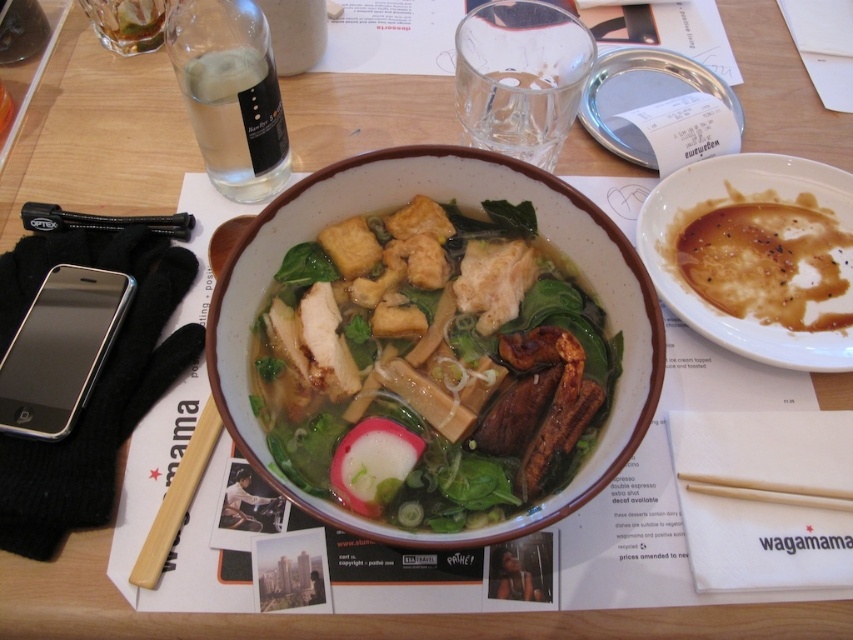
You are a waiter at Wagamama. You need to place a new menu on the table. There are two points marked on the table mat. The first point is at coordinate point(x=601, y=317) and the second is at point(x=165, y=541). According to the spatial arrangement, which point is closer to the edge of the table?

Point(x=165, y=541) is closer to the edge of the table because it is in front of point(x=601, y=317), which is further back.

You are a food delivery person who needs to know if the bowl of translucent broth with mixed vegetables and tofu at center can fit into a container that is the same width as the wooden chopstick at center. Can it fit?

The translucent broth with mixed vegetables and tofu at center is wider than the wooden chopstick at center, so the container with the same width as the chopstick would not be wide enough to fit the bowl.

You are a food delivery person who needs to place a protective cover over the silver metallic smartphone at lower left to prevent spills from the translucent broth with mixed vegetables and tofu at center. Can the cover fit over the smartphone if the cover is designed to be the same size as the smartphone?

The translucent broth with mixed vegetables and tofu at center is wider than the silver metallic smartphone at lower left, so the cover designed to be the same size as the smartphone should fit since it matches the smartphone dimensions.